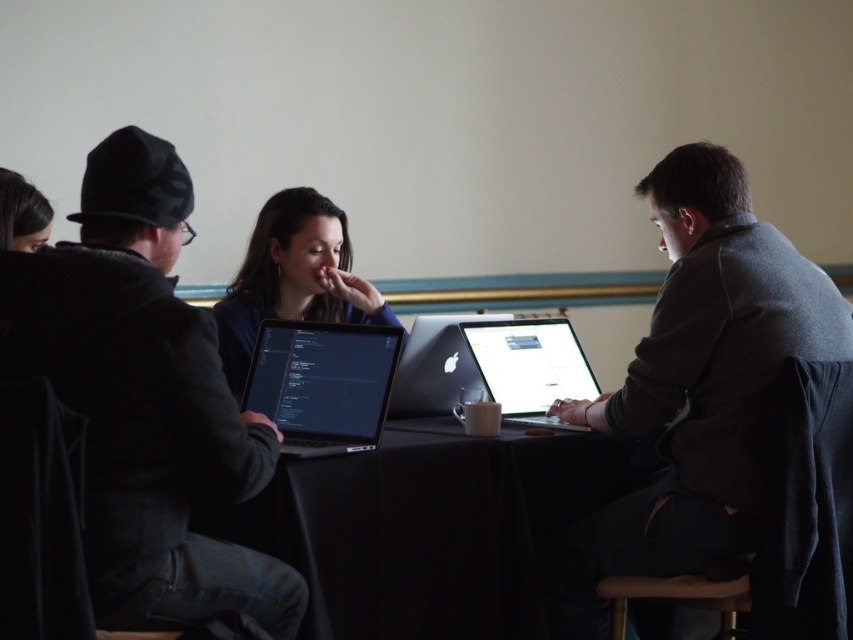
You are organizing a small event and need to place a decorative plate between the gray woolen sweater at right and the matte black laptop at center. Based on their widths, which object should the plate be closer to?

The gray woolen sweater at right might be wider than the matte black laptop at center, so the plate should be placed closer to the gray woolen sweater at right to ensure it aligns with the wider object.

You are a person who needs to place a 12cm tall object on the table. The table has the matte black laptop at center and the wooden at lower center. Which object can you place the object on top of without it being too tall?

The wooden at lower center is shorter than the matte black laptop at center. Since the wooden at lower center is much shorter, placing the 12cm tall object on top of it would be possible without exceeding its height. However, the matte black laptop at center is much taller, so the object might not fit on top of it depending on the laptop screen height. But since the question is about not being too tall, the safer choice is the wooden at lower center.

You are standing at the entrance of the room and want to place a new object at the coordinates mentioned for the gray woolen sweater at right. What object is currently at that location?

The gray woolen sweater at right is located at point (x=695, y=387), so placing a new object there would displace the gray woolen sweater at right.